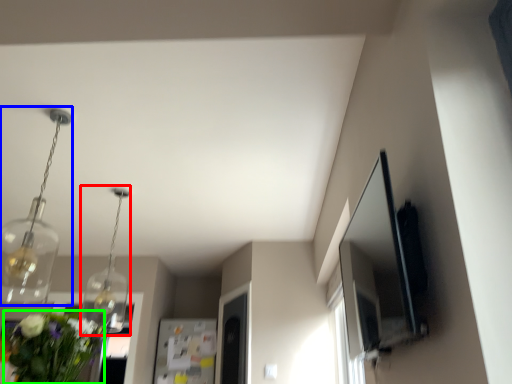
Question: Based on their relative distances, which object is farther from light fixture (highlighted by a red box)? Choose from light fixture (highlighted by a blue box) and floral arrangement (highlighted by a green box).

Choices:
 (A) light fixture
 (B) floral arrangement

Answer: (B)